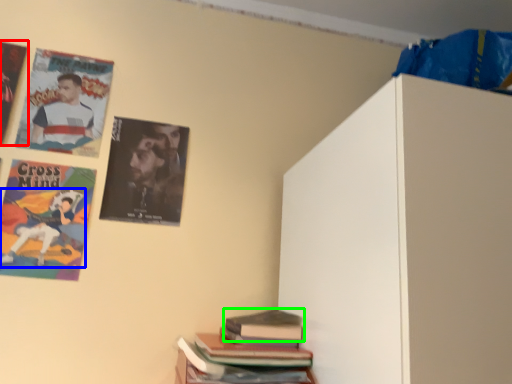
Question: Which is nearer to the poster (highlighted by a red box)? person (highlighted by a blue box) or book (highlighted by a green box).

Choices:
 (A) person
 (B) book

Answer: (A)